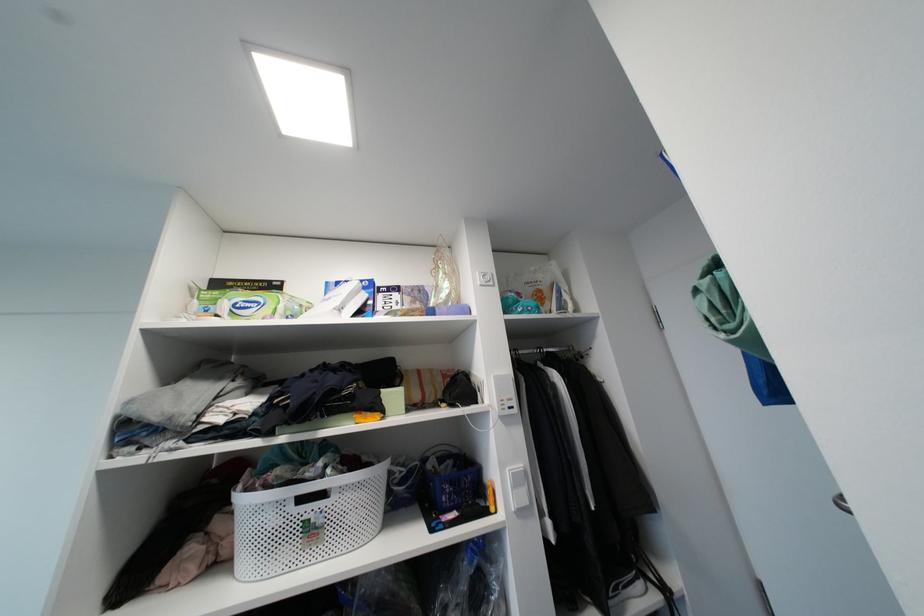
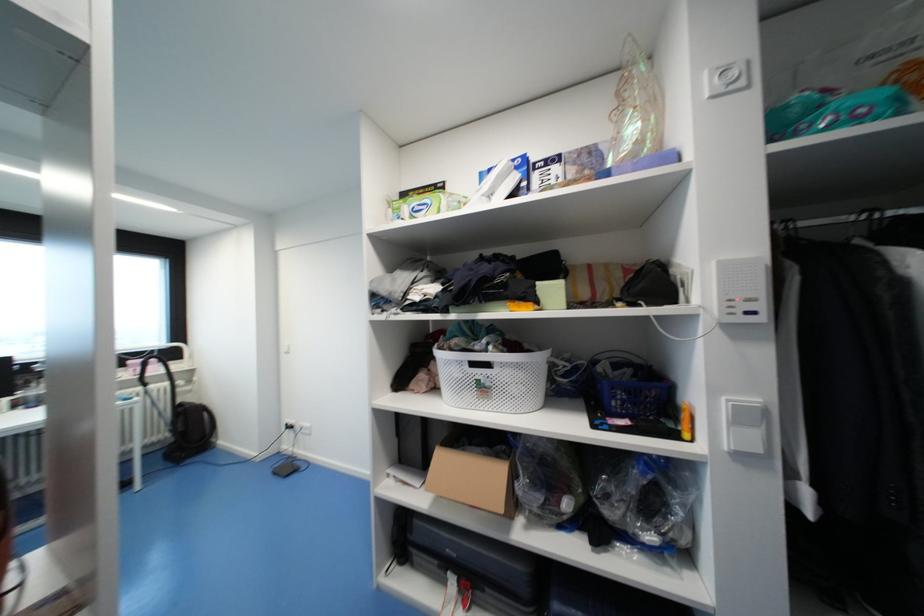
Where in the second image is the point corresponding to point (306, 501) from the first image?

(477, 365)